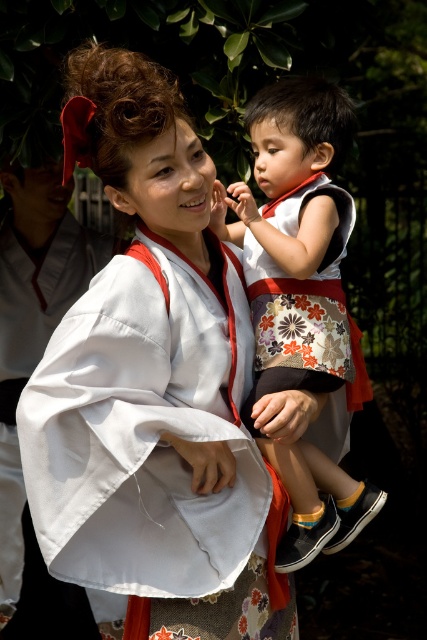
Question: Is white silk kimono at center further to camera compared to white satin kimono at center?

Choices:
 (A) yes
 (B) no

Answer: (B)

Question: Which point appears closest to the camera in this image?

Choices:
 (A) tap(70, 269)
 (B) tap(262, 390)

Answer: (B)

Question: Is white silk kimono at center in front of white cotton kimono at center?

Choices:
 (A) yes
 (B) no

Answer: (A)

Question: Where is white silk kimono at center located in relation to white satin kimono at center in the image?

Choices:
 (A) above
 (B) below

Answer: (A)

Question: Among these points, which one is farthest from the camera?

Choices:
 (A) (230, 292)
 (B) (20, 188)
 (C) (283, 90)

Answer: (B)

Question: Among these objects, which one is nearest to the camera?

Choices:
 (A) white silk kimono at center
 (B) white cotton kimono at center

Answer: (A)